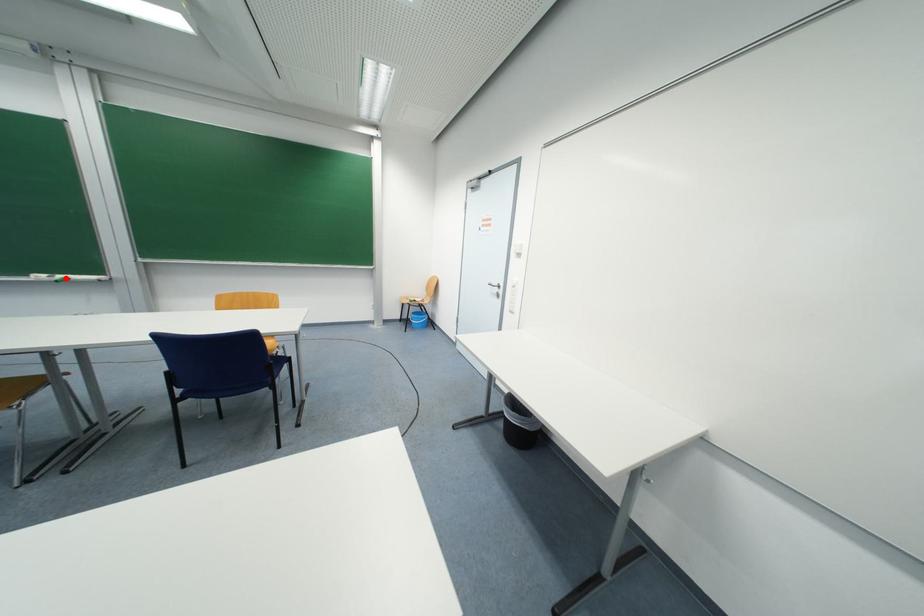
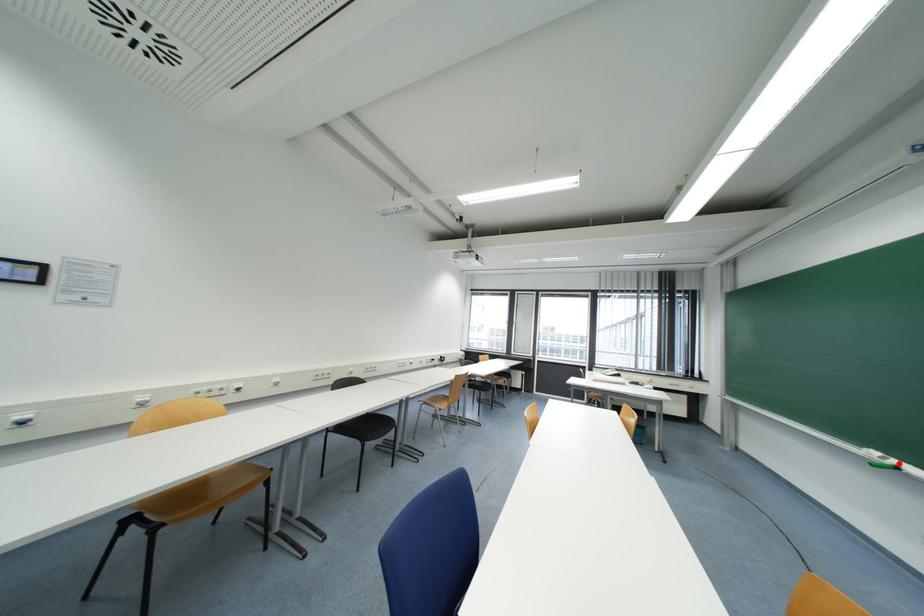
I am providing you with two images of the same scene from different viewpoints. A red point is marked on the first image and another point is marked on the second image. Is the marked point in image1 the same physical position as the marked point in image2?

Yes